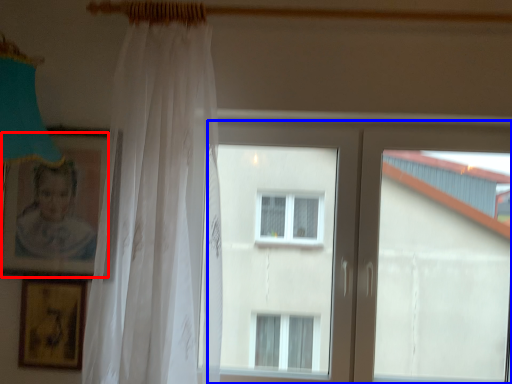
Question: Which object is further to the camera taking this photo, picture frame (highlighted by a red box) or window (highlighted by a blue box)?

Choices:
 (A) picture frame
 (B) window

Answer: (B)